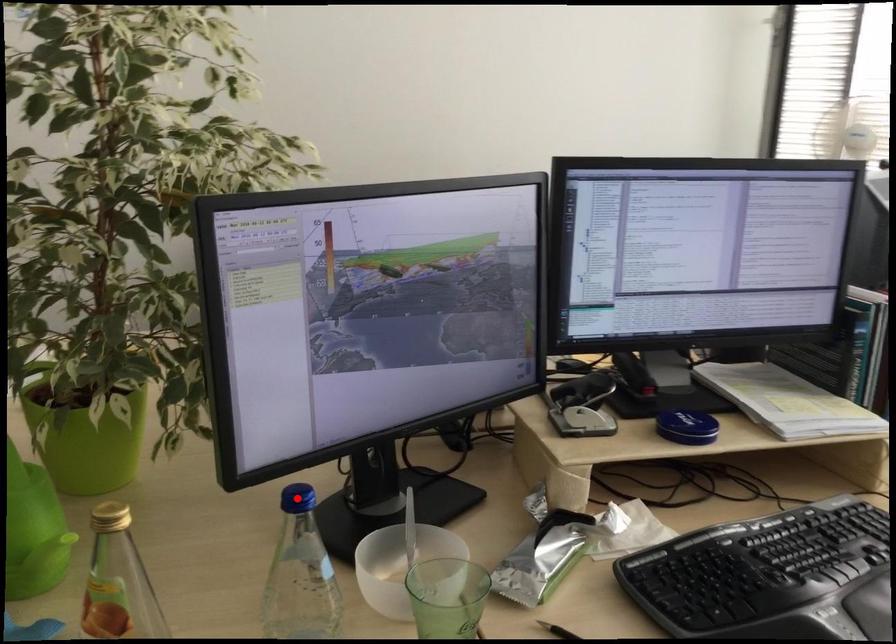
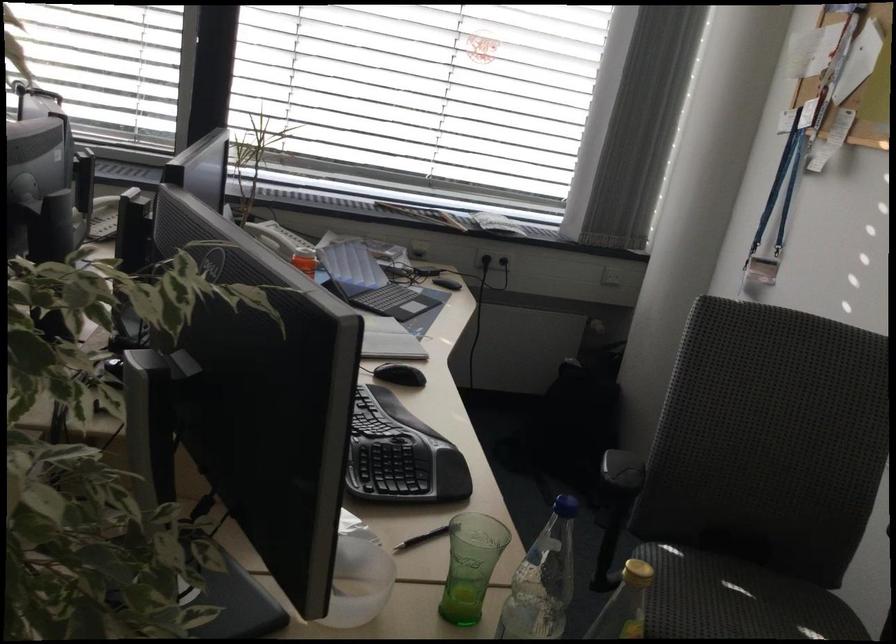
Question: I am providing you with two images of the same scene from different viewpoints. A red point is marked on the first image. Can you still see the location of the red point in image 2?

Choices:
 (A) Yes
 (B) No

Answer: (B)